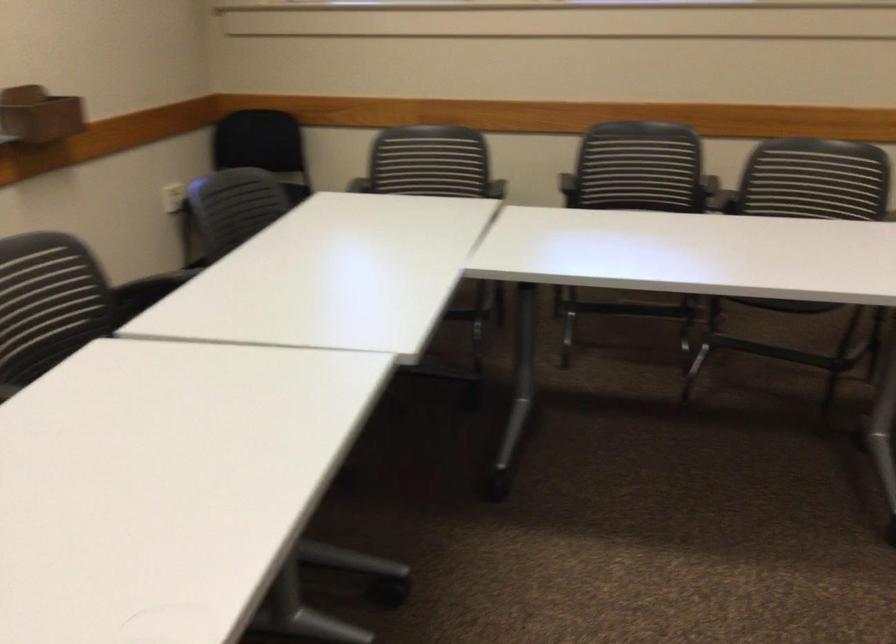
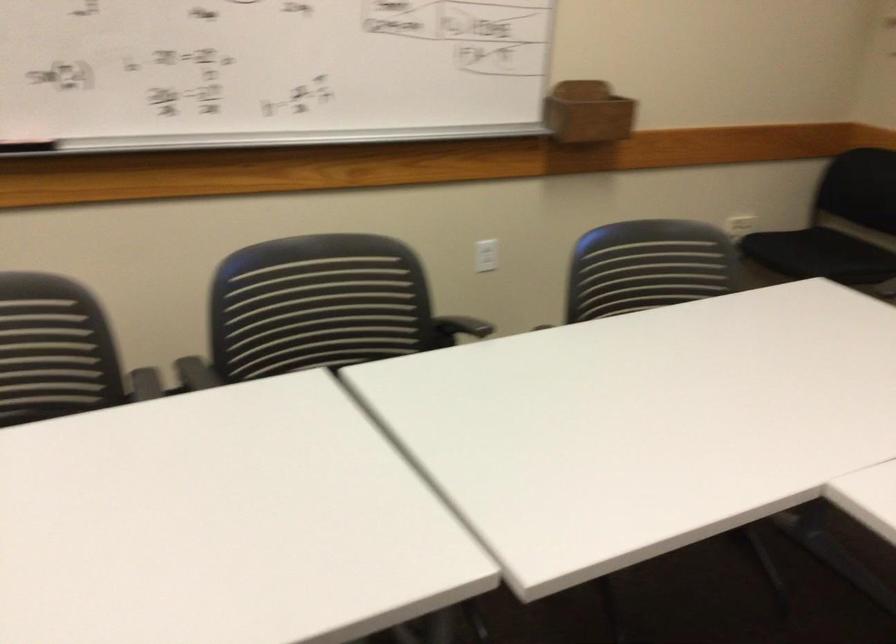
Find the pixel in the second image that matches point (126, 289) in the first image.

(458, 328)